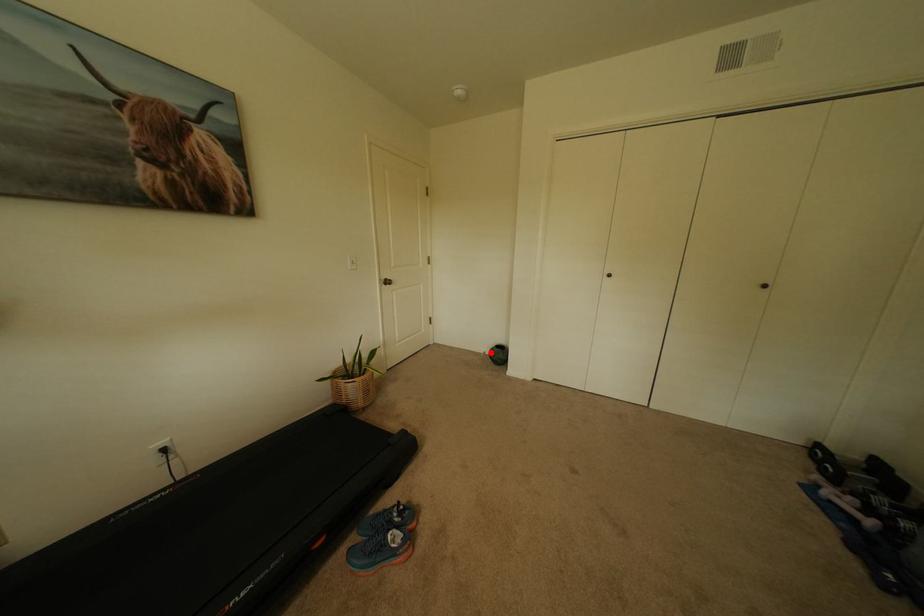
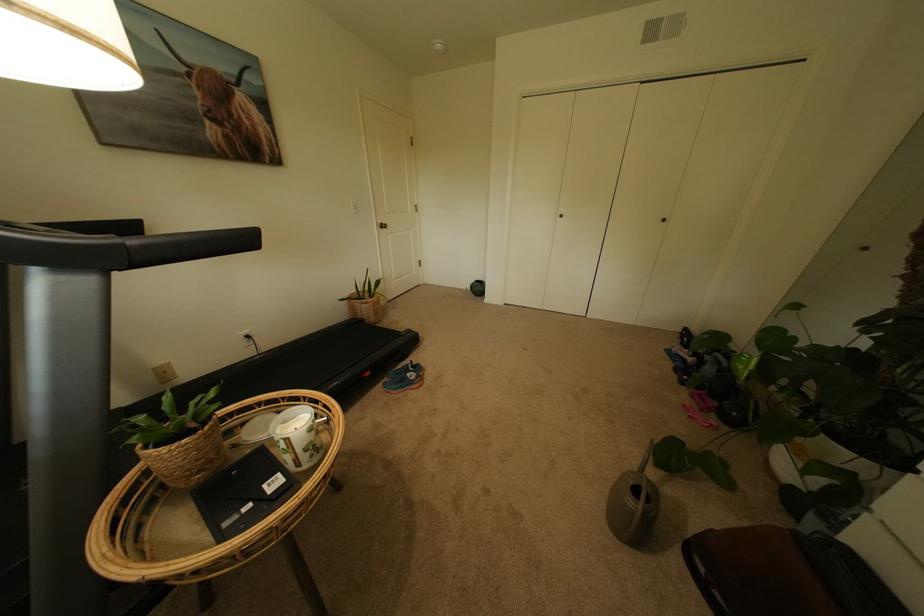
Question: I am providing you with two images of the same scene from different viewpoints. In image1, a red point is highlighted. Considering the same 3D point in image2, which of the following is correct?

Choices:
 (A) It is closer
 (B) It is farther

Answer: (A)